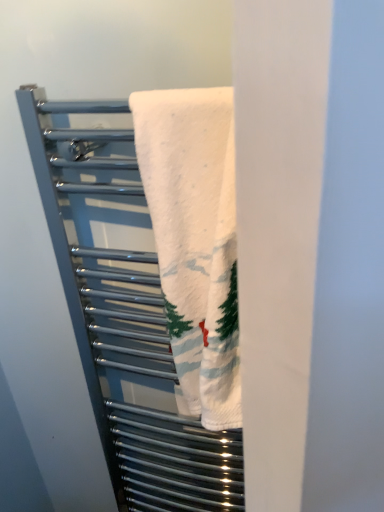
This screenshot has height=512, width=384. Describe the element at coordinates (124, 320) in the screenshot. I see `chrome metallic towel rack at center` at that location.

You are a GUI agent. You are given a task and a screenshot of the screen. Output one action in this format:
    pyautogui.click(x=<x>, y=<y>)
    Task: Click on the chrome metallic towel rack at center
    The height and width of the screenshot is (512, 384).
    Given the screenshot: What is the action you would take?
    pyautogui.click(x=124, y=320)

Find the location of a particular element. The width and height of the screenshot is (384, 512). chrome metallic towel rack at center is located at coordinates (124, 320).